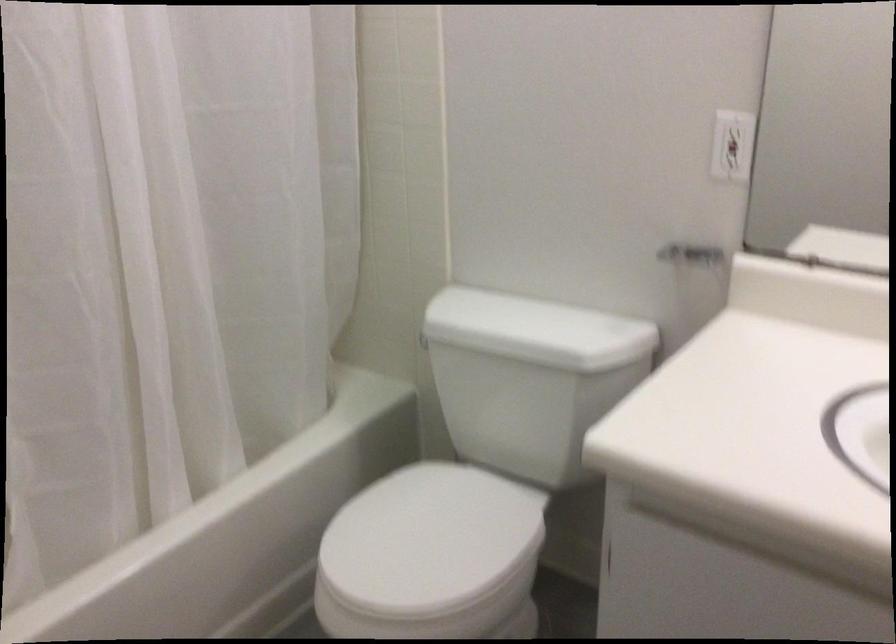
Describe the element at coordinates (421, 339) in the screenshot. I see `the toilet flush handle` at that location.